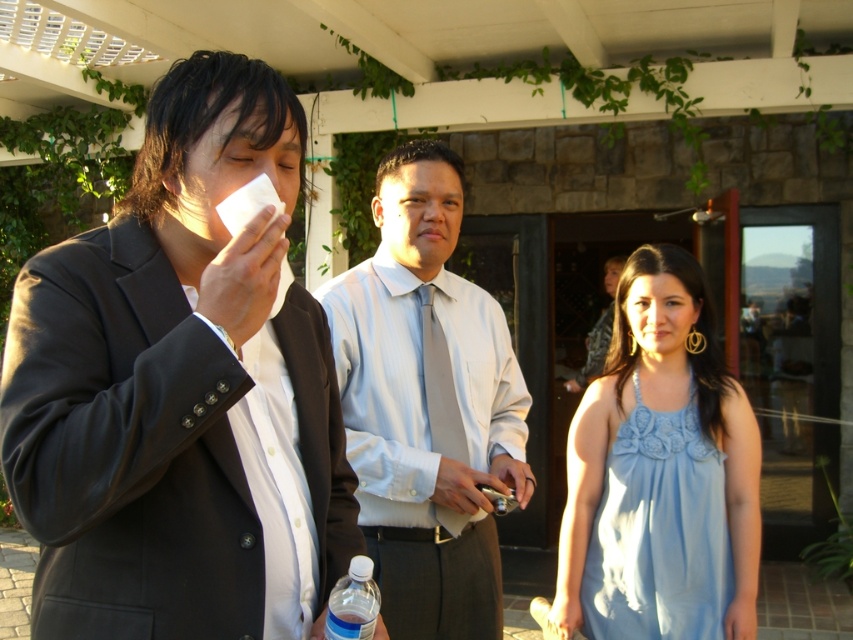
You are a photographer standing at the edge of the patio. You want to take a photo that includes both the light blue shirt at center and the clear plastic bottle at lower center. What is the minimum distance you should maintain from the bottle to ensure both subjects are in frame?

The light blue shirt at center is 35.77 inches from the clear plastic bottle at lower center. To include both in the photo, you should position yourself at least 35.77 inches away from the bottle, ensuring both are within the frame.

You are a photographer trying to capture a group photo of the light blue shirt at center and the clear plastic bottle at lower center. Which object is wider in the image?

The light blue shirt at center is wider than the clear plastic bottle at lower center according to the description.